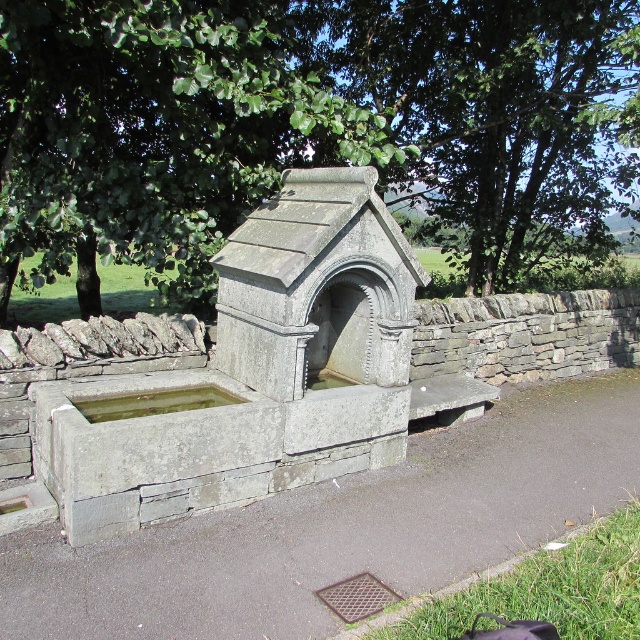
Consider the image. You are standing near the green stone trough at center and want to walk towards the green leafy tree at upper center. Which direction should you move to get closer to the tree?

The green leafy tree at upper center is further to the viewer than the green stone trough at center, so you should move forward away from the trough to reach the tree.

You are standing near the old stone structure and want to place a small bench between the green leafy tree at upper center and the green stone trough at center. Considering their sizes, which object should the bench be closer to?

The bench should be placed closer to the green stone trough at center because the green leafy tree at upper center is wider, leaving less space between them for the bench.